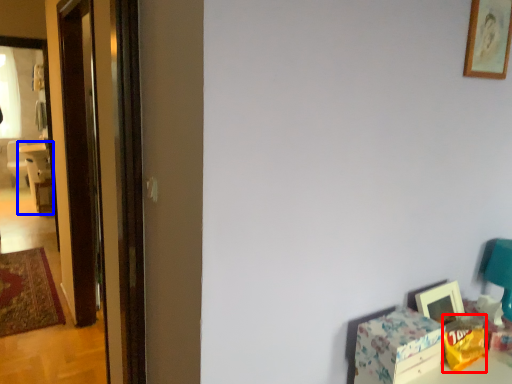
Question: Which object appears farthest to the camera in this image, box (highlighted by a red box) or chair (highlighted by a blue box)?

Choices:
 (A) box
 (B) chair

Answer: (B)